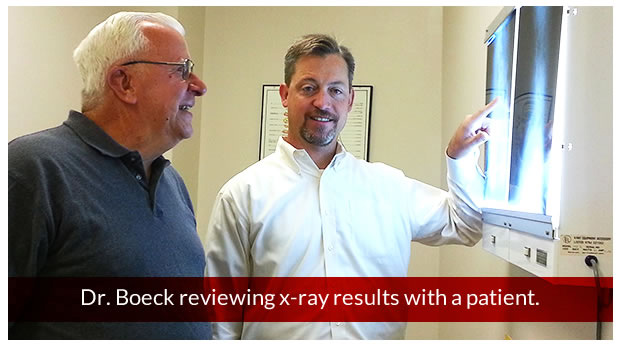
Locate an element on the screen. This screenshot has height=346, width=621. board is located at coordinates (532, 150).